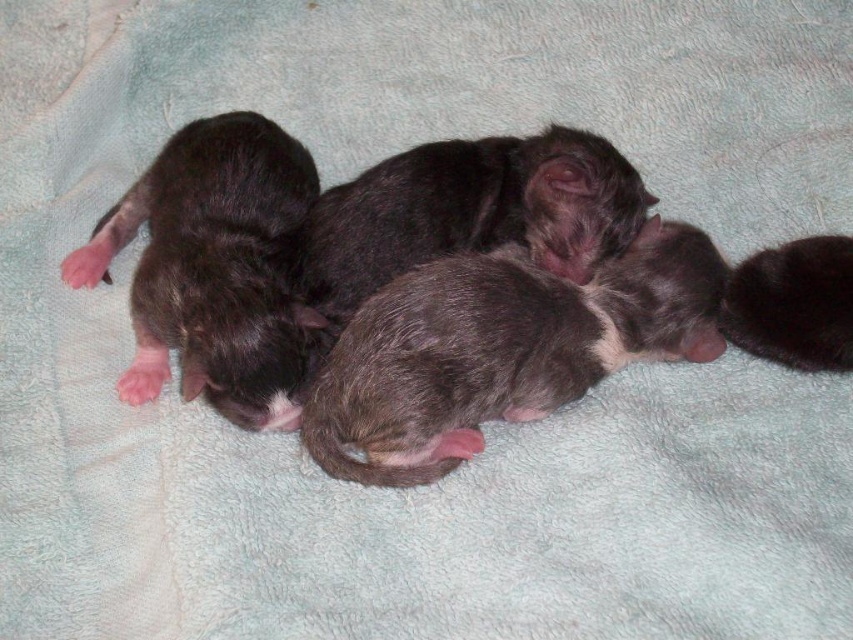
Does dark gray fur at left appear on the left side of fuzzy black puppies at center?

Correct, you'll find dark gray fur at left to the left of fuzzy black puppies at center.

Can you confirm if dark gray fur at left is wider than fuzzy black puppies at center?

Incorrect, dark gray fur at left's width does not surpass fuzzy black puppies at center's.

Image resolution: width=853 pixels, height=640 pixels. What do you see at coordinates (216, 268) in the screenshot?
I see `dark gray fur at left` at bounding box center [216, 268].

What are the coordinates of `dark gray fur at left` in the screenshot? It's located at (216, 268).

Is fuzzy black puppies at center positioned at the back of dark gray fur kitten at right?

Yes, fuzzy black puppies at center is behind dark gray fur kitten at right.

Does fuzzy black puppies at center have a lesser height compared to dark gray fur kitten at right?

No, fuzzy black puppies at center is not shorter than dark gray fur kitten at right.

Identify the location of fuzzy black puppies at center. (469, 212).

At what (x,y) coordinates should I click in order to perform the action: click on fuzzy black puppies at center. Please return your answer as a coordinate pair (x, y). The height and width of the screenshot is (640, 853). Looking at the image, I should click on (469, 212).

Can you confirm if gray fur kitten at center is positioned to the right of dark gray fur at left?

Yes, gray fur kitten at center is to the right of dark gray fur at left.

Is point (503, 326) more distant than point (233, 304)?

Yes.

Find the location of a particular element. The image size is (853, 640). gray fur kitten at center is located at coordinates (500, 349).

This screenshot has height=640, width=853. Identify the location of gray fur kitten at center. (500, 349).